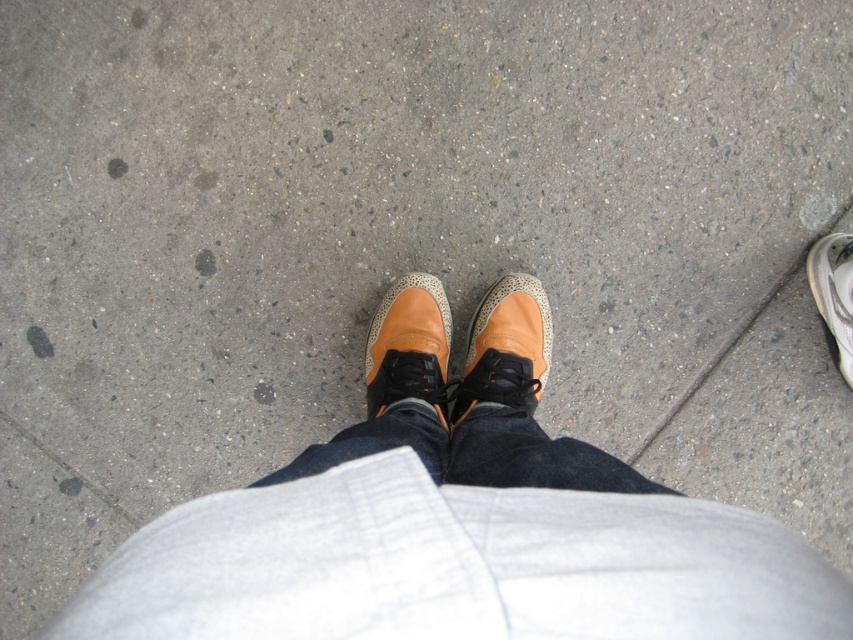
You are trying to decide which of your two sneakers to wear for a walk. You know that the tan textured sneaker at center is wider than the white textured sneaker at lower right. Which sneaker would require more space in your shoebox?

The tan textured sneaker at center requires more space in the shoebox because its width surpasses that of the white textured sneaker at lower right.

You are standing on a sidewalk and want to kick a small pebble that is near your feet. Which sneaker, the tan suede sneaker at center or the white textured sneaker at lower right, is positioned lower and closer to the pebble on the concrete surface?

The tan suede sneaker at center is positioned lower than the white textured sneaker at lower right, so it is closer to the pebble on the concrete surface.

Consider the image. You are a delivery robot with a 24 inch wide package. You need to move from the tan suede sneaker at center to the white textured sneaker at lower right. Is there enough space between them for your package?

The tan suede sneaker at center is 30.95 inches from the white textured sneaker at lower right, so yes, the delivery robot can move the 24 inch wide package between them since the distance is greater than the package width.